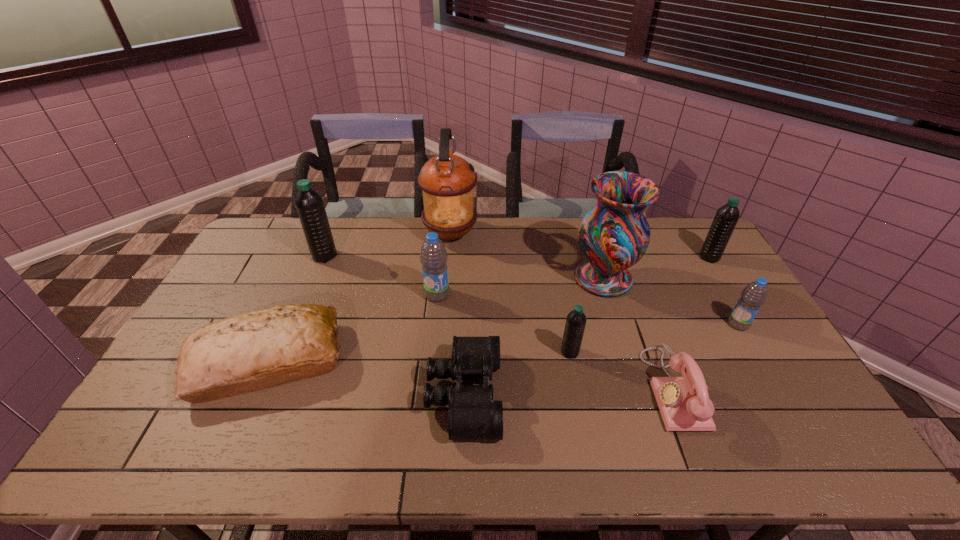
The image size is (960, 540). What are the coordinates of `empty location between the right blue water bottle and the telephone` in the screenshot? It's located at (706, 356).

Find the location of `vacant area that lies between the bread and the oil lamp`. vacant area that lies between the bread and the oil lamp is located at coordinates (359, 298).

Where is `free space between the nearest water bottle and the second smallest black water bottle`? The image size is (960, 540). free space between the nearest water bottle and the second smallest black water bottle is located at coordinates (639, 305).

What are the coordinates of `vacant area that lies between the third farthest water bottle and the black binoculars` in the screenshot? It's located at (450, 345).

Locate which object is the seventh closest to the smaller blue water bottle. Please provide its 2D coordinates. Your answer should be formatted as a tuple, i.e. [(x, y)], where the tuple contains the x and y coordinates of a point satisfying the conditions above.

[(433, 257)]

Locate an element on the screen. The width and height of the screenshot is (960, 540). object that is the sixth closest one to the binoculars is located at coordinates (447, 181).

Select which water bottle appears as the third closest to the bread. Please provide its 2D coordinates. Your answer should be formatted as a tuple, i.e. [(x, y)], where the tuple contains the x and y coordinates of a point satisfying the conditions above.

[(575, 324)]

Identify the location of the third closest water bottle to the black binoculars. (309, 204).

I want to click on black water bottle that is the closest to the right blue water bottle, so click(x=727, y=216).

Identify which black water bottle is the second nearest to the biggest black water bottle. Please provide its 2D coordinates. Your answer should be formatted as a tuple, i.e. [(x, y)], where the tuple contains the x and y coordinates of a point satisfying the conditions above.

[(727, 216)]